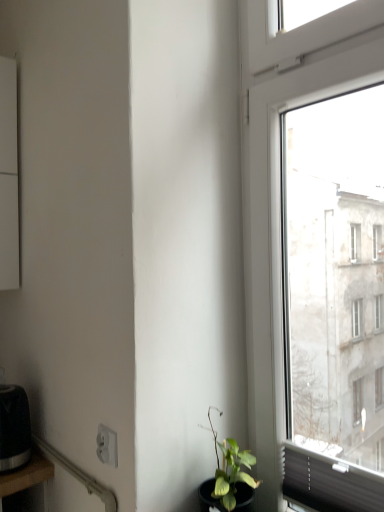
Question: From a real-world perspective, relative to white plastic power plugs and sockets at lower left, is black wood table at lower left vertically above or below?

Choices:
 (A) above
 (B) below

Answer: (B)

Question: From their relative heights in the image, would you say black wood table at lower left is taller or shorter than white plastic power plugs and sockets at lower left?

Choices:
 (A) short
 (B) tall

Answer: (B)

Question: Estimate the real-world distances between objects in this image. Which object is farther from the black matte toaster at lower left?

Choices:
 (A) white plastic power plugs and sockets at lower left
 (B) black wood table at lower left

Answer: (A)

Question: Estimate the real-world distances between objects in this image. Which object is farther from the black matte toaster at lower left?

Choices:
 (A) white plastic power plugs and sockets at lower left
 (B) black wood table at lower left

Answer: (A)